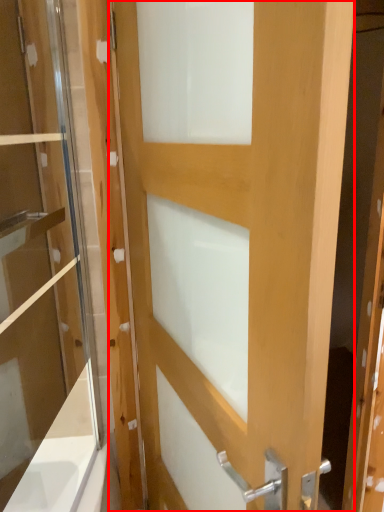
Question: From the image's perspective, what is the correct spatial positioning of door (annotated by the red box) in reference to screen door?

Choices:
 (A) above
 (B) below

Answer: (B)